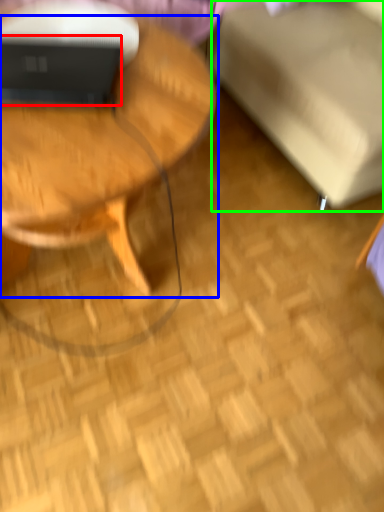
Question: Estimate the real-world distances between objects in this image. Which object is closer to laptop (highlighted by a red box), coffee table (highlighted by a blue box) or swivel chair (highlighted by a green box)?

Choices:
 (A) coffee table
 (B) swivel chair

Answer: (A)